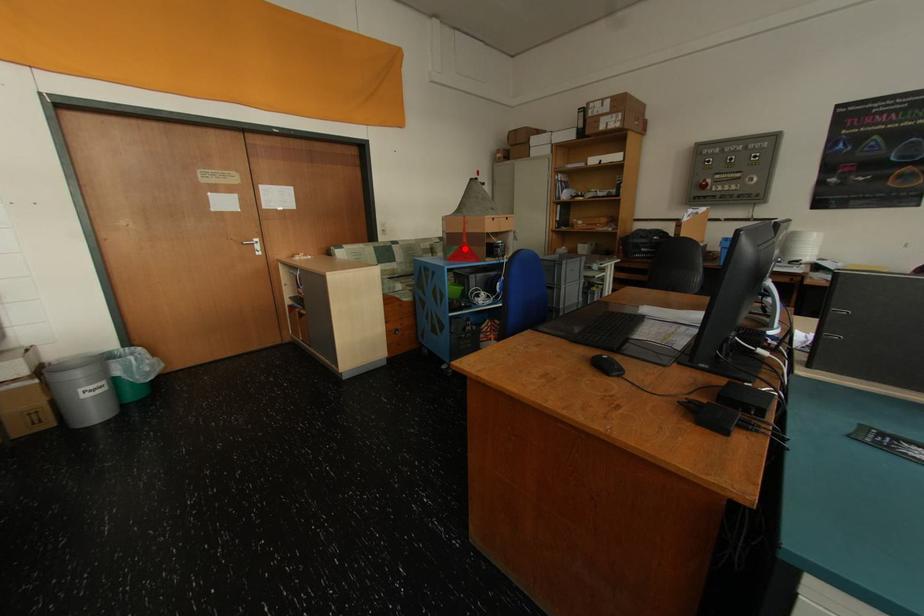
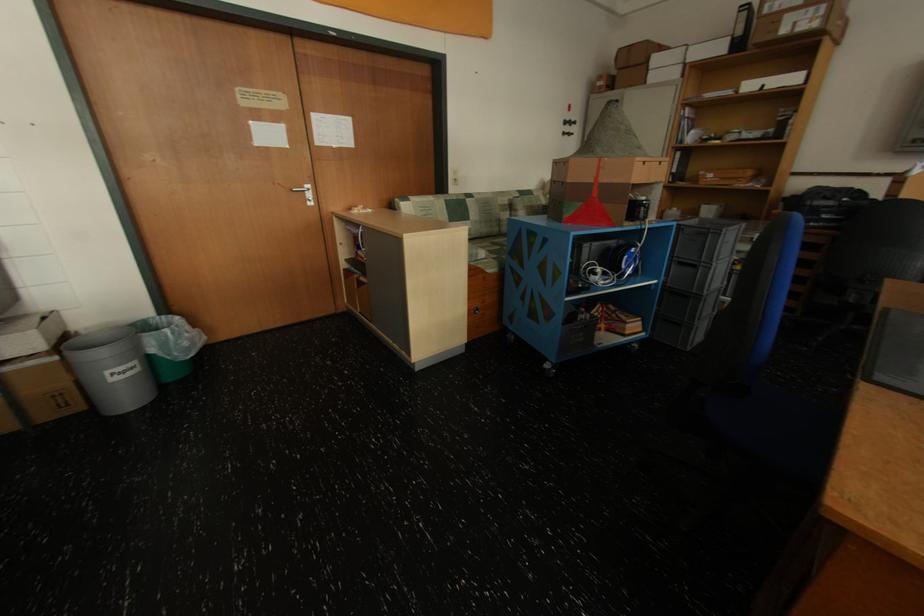
In the second image, find the point that corresponds to the highlighted location in the first image.

(589, 206)